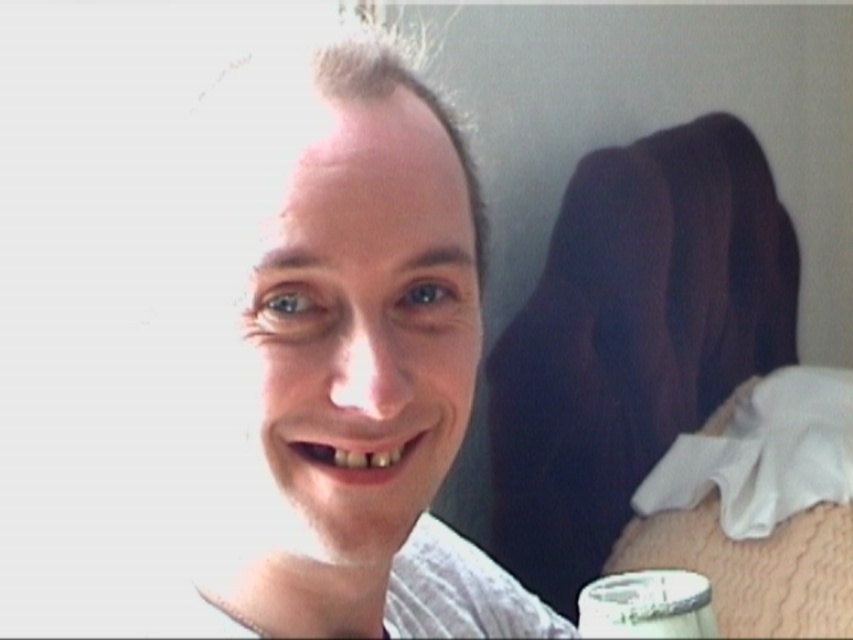
Question: Can you confirm if white textured shirt at center is bigger than metallic silver cup at lower right?

Choices:
 (A) yes
 (B) no

Answer: (A)

Question: Does white textured shirt at center appear on the left side of metallic silver cup at lower right?

Choices:
 (A) yes
 (B) no

Answer: (A)

Question: Which point is closer to the camera taking this photo?

Choices:
 (A) (631, 630)
 (B) (253, 566)

Answer: (B)

Question: Among these points, which one is nearest to the camera?

Choices:
 (A) (641, 580)
 (B) (294, 624)

Answer: (B)

Question: Which of the following is the closest to the observer?

Choices:
 (A) metallic silver cup at lower right
 (B) white textured shirt at center

Answer: (B)

Question: Can you confirm if white textured shirt at center is wider than metallic silver cup at lower right?

Choices:
 (A) yes
 (B) no

Answer: (A)